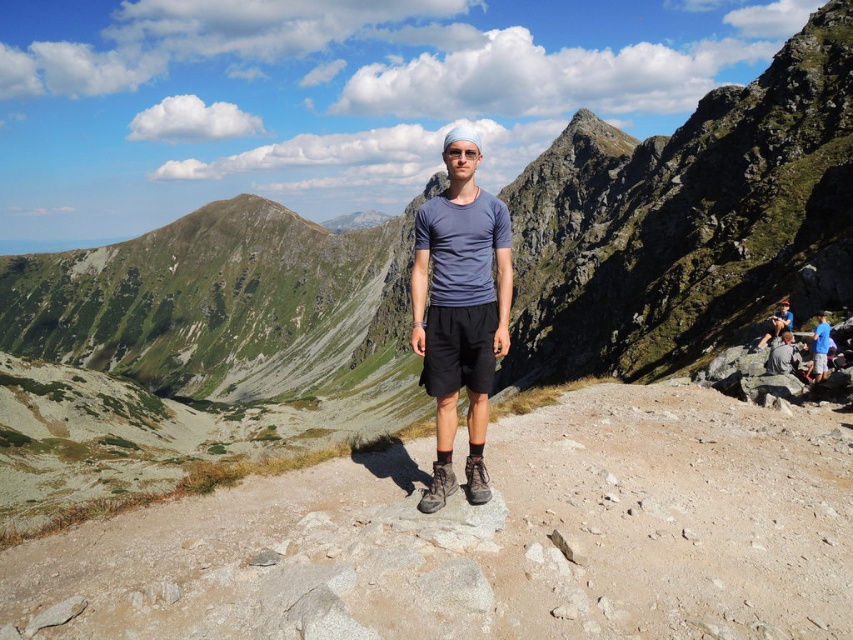
Can you confirm if matte blue t-shirt at center is positioned to the right of blue fabric shirt at center?

No, matte blue t-shirt at center is not to the right of blue fabric shirt at center.

Is matte blue t-shirt at center further to the viewer compared to blue fabric shirt at center?

No, matte blue t-shirt at center is in front of blue fabric shirt at center.

Measure the distance between point (505, 353) and camera.

Point (505, 353) and camera are 23.04 meters apart from each other.

Locate an element on the screen. This screenshot has height=640, width=853. matte blue t-shirt at center is located at coordinates (460, 308).

Is point (453, 140) positioned after point (811, 353)?

No, it is not.

Can you confirm if matte blue t-shirt at center is wider than blue fabric shirt at right?

Yes.

Is point (426, 284) farther from camera compared to point (820, 310)?

No.

Where is `matte blue t-shirt at center`? Image resolution: width=853 pixels, height=640 pixels. matte blue t-shirt at center is located at coordinates (460, 308).

Is blue fabric shirt at right shorter than blue fabric shirt at center?

No.

Where is `blue fabric shirt at right`? blue fabric shirt at right is located at coordinates (819, 348).